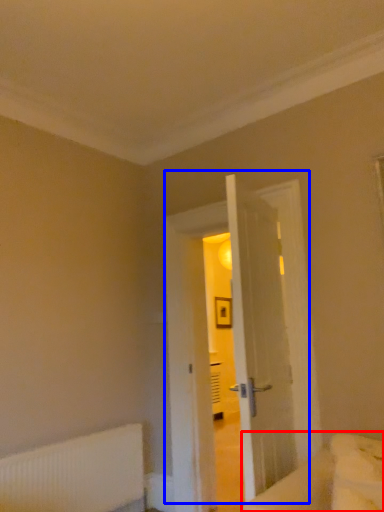
Question: Which object appears farthest to the camera in this image, bed (highlighted by a red box) or door (highlighted by a blue box)?

Choices:
 (A) bed
 (B) door

Answer: (B)